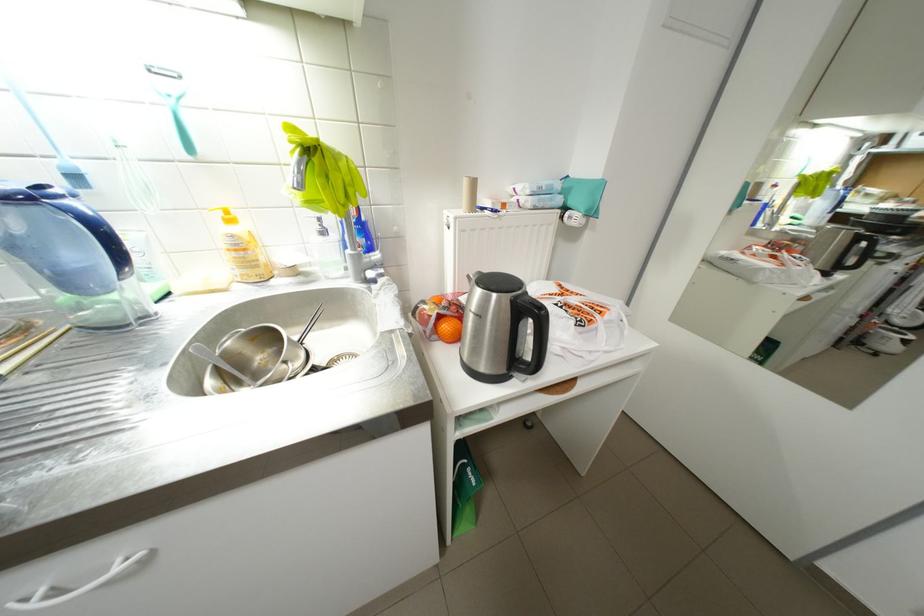
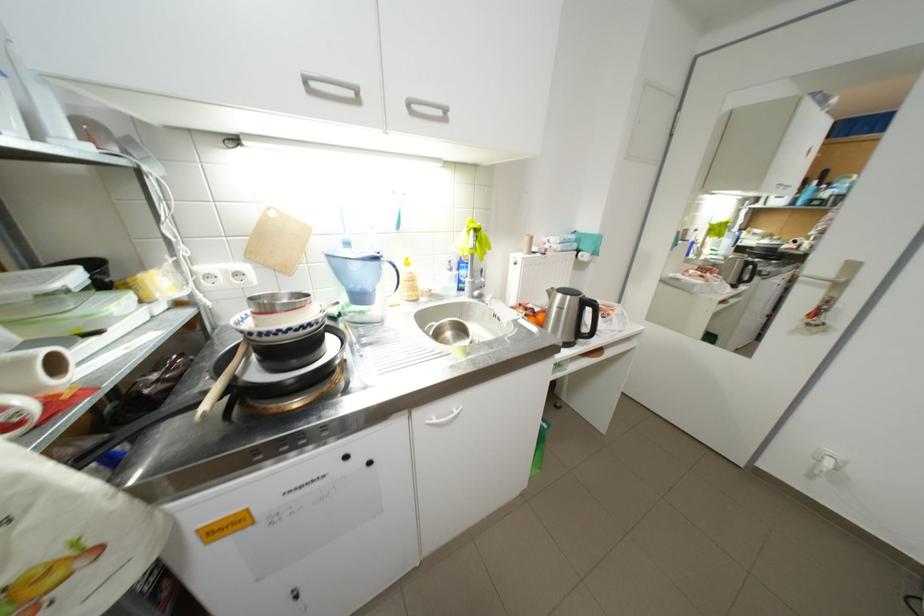
Locate, in the second image, the point that corresponds to pixel 43 200 in the first image.

(387, 259)